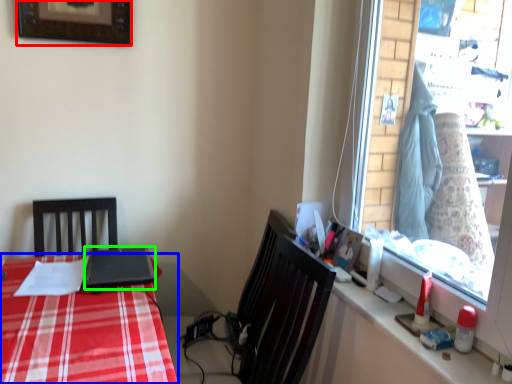
Question: Which is farther away from picture frame (highlighted by a red box)? desk (highlighted by a blue box) or laptop (highlighted by a green box)?

Choices:
 (A) desk
 (B) laptop

Answer: (A)